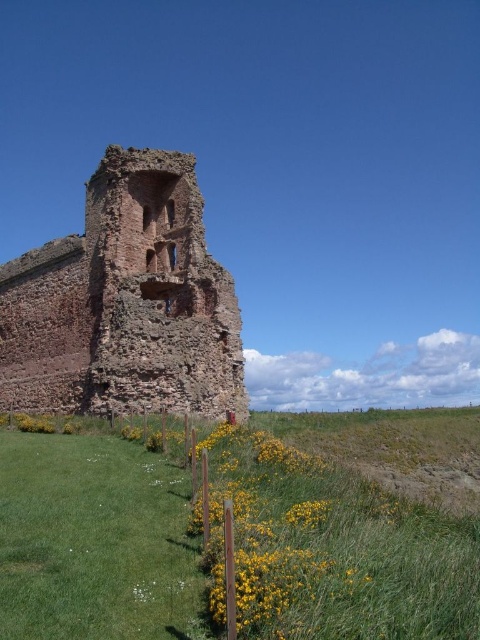
Question: Considering the relative positions of green grass at lower left and rustic stone ruins at center in the image provided, where is green grass at lower left located with respect to rustic stone ruins at center?

Choices:
 (A) left
 (B) right

Answer: (B)

Question: Which of the following is the farthest from the observer?

Choices:
 (A) (445, 627)
 (B) (110, 198)

Answer: (B)

Question: Which point is closer to the camera taking this photo?

Choices:
 (A) (159, 269)
 (B) (201, 614)

Answer: (B)

Question: Can you confirm if green grass at lower left is bigger than rustic stone ruins at center?

Choices:
 (A) no
 (B) yes

Answer: (A)

Question: Can you confirm if green grass at lower left is positioned above rustic stone ruins at center?

Choices:
 (A) yes
 (B) no

Answer: (B)